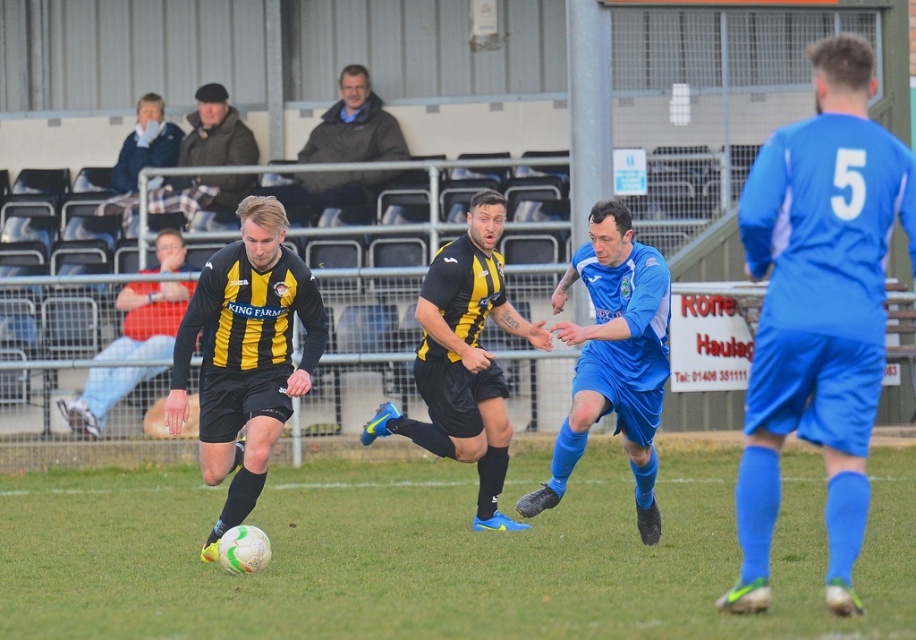
Can you confirm if blue smooth soccer player at center is smaller than blue denim jacket at upper left?

Incorrect, blue smooth soccer player at center is not smaller in size than blue denim jacket at upper left.

What do you see at coordinates (613, 356) in the screenshot?
I see `blue smooth soccer player at center` at bounding box center [613, 356].

Identify the location of blue smooth soccer player at center. (613, 356).

Is green grass at center to the left of blue smooth soccer player at center from the viewer's perspective?

Indeed, green grass at center is positioned on the left side of blue smooth soccer player at center.

Looking at this image, does green grass at center have a lesser height compared to blue smooth soccer player at center?

Correct, green grass at center is not as tall as blue smooth soccer player at center.

Which is behind, point (815, 531) or point (638, 374)?

Positioned behind is point (815, 531).

This screenshot has width=916, height=640. I want to click on green grass at center, so click(439, 554).

Is black/yellow striped jersey at center to the right of yellow-black striped jersey at center from the viewer's perspective?

Incorrect, black/yellow striped jersey at center is not on the right side of yellow-black striped jersey at center.

Is black/yellow striped jersey at center to the left of yellow-black striped jersey at center from the viewer's perspective?

Yes, black/yellow striped jersey at center is to the left of yellow-black striped jersey at center.

Between point (209, 301) and point (509, 330), which one is positioned in front?

Point (209, 301) is more forward.

What are the coordinates of `black/yellow striped jersey at center` in the screenshot? It's located at (245, 355).